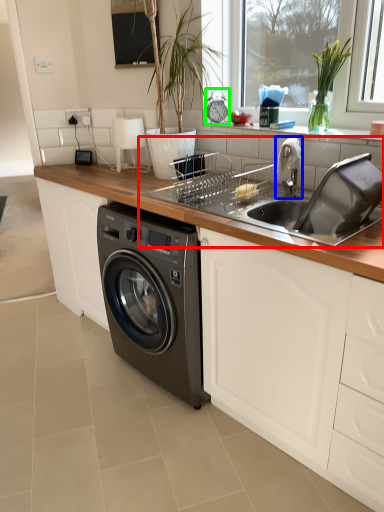
Question: Which object is the closest to the sink (highlighted by a red box)? Choose among these: faucet (highlighted by a blue box) or appliance (highlighted by a green box).

Choices:
 (A) faucet
 (B) appliance

Answer: (A)